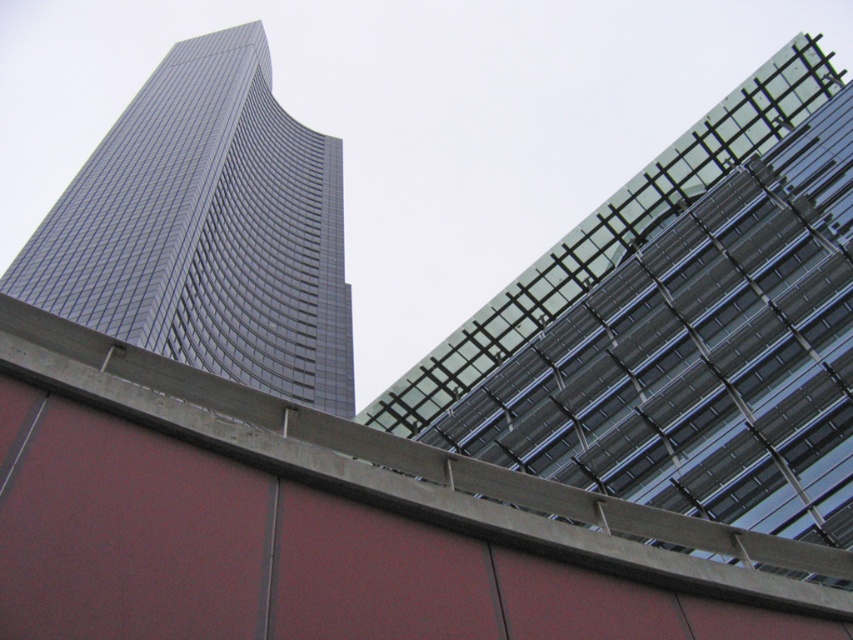
Question: Which point is closer to the camera?

Choices:
 (A) (743, 522)
 (B) (144, 237)

Answer: (A)

Question: Does transparent glass building at upper right appear on the right side of shiny glass skyscraper at left?

Choices:
 (A) yes
 (B) no

Answer: (A)

Question: Which point is closer to the camera taking this photo?

Choices:
 (A) (201, 221)
 (B) (703, 298)

Answer: (B)

Question: Can you confirm if transparent glass building at upper right is thinner than shiny glass skyscraper at left?

Choices:
 (A) no
 (B) yes

Answer: (B)

Question: Which point appears closest to the camera in this image?

Choices:
 (A) (845, 125)
 (B) (299, 125)

Answer: (A)

Question: Can you confirm if transparent glass building at upper right is positioned to the left of shiny glass skyscraper at left?

Choices:
 (A) no
 (B) yes

Answer: (A)